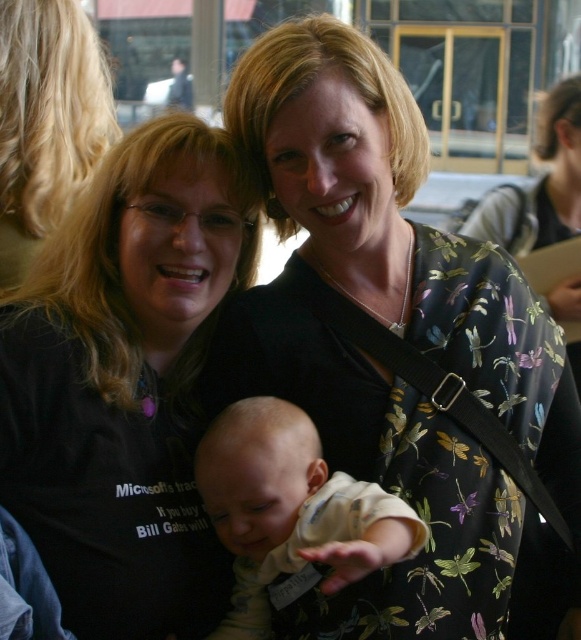
Is point (66, 429) farther from camera compared to point (59, 186)?

That is False.

Is black matte shirt at left above black fabric shirt at upper left?

Actually, black matte shirt at left is below black fabric shirt at upper left.

The height and width of the screenshot is (640, 581). Describe the element at coordinates (125, 381) in the screenshot. I see `black matte shirt at left` at that location.

Where is `black matte shirt at left`? The image size is (581, 640). black matte shirt at left is located at coordinates (125, 381).

Which is in front, point (315, 436) or point (53, 173)?

Point (315, 436) is in front.

From the picture: Does light beige soft fabric baby at center appear on the right side of black fabric shirt at upper left?

Indeed, light beige soft fabric baby at center is positioned on the right side of black fabric shirt at upper left.

Who is more forward, (418, 547) or (44, 84)?

Point (418, 547) is more forward.

In order to click on light beige soft fabric baby at center in this screenshot , I will do `click(290, 508)`.

Can you confirm if floral-patterned dress at center is positioned to the right of black fabric shirt at upper left?

Indeed, floral-patterned dress at center is positioned on the right side of black fabric shirt at upper left.

Is point (309, 150) positioned after point (21, 64)?

No, it is not.

I want to click on floral-patterned dress at center, so click(x=396, y=346).